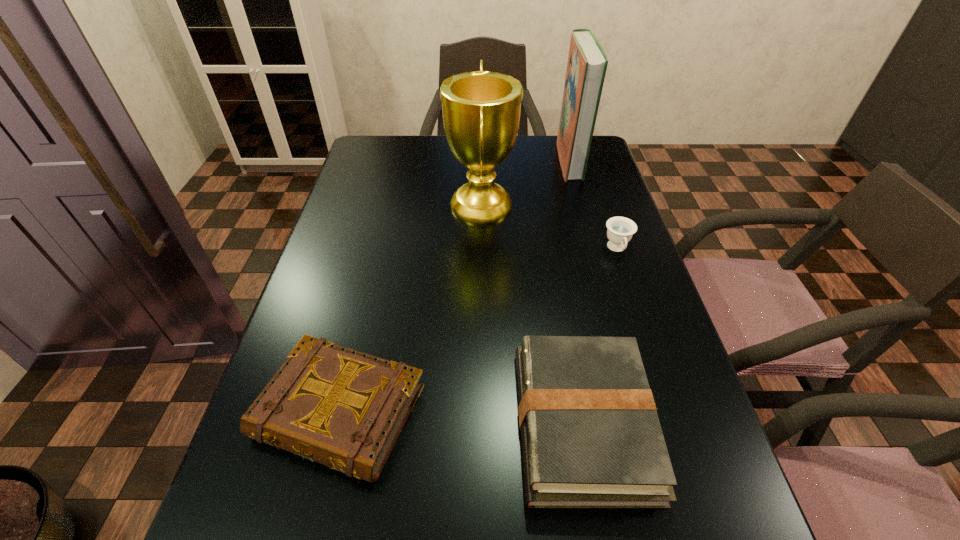
Where is `teacup located in the right edge section of the desktop`? Image resolution: width=960 pixels, height=540 pixels. teacup located in the right edge section of the desktop is located at coordinates (620, 230).

At what (x,y) coordinates should I click in order to perform the action: click on object at the far right corner. Please return your answer as a coordinate pair (x, y). This screenshot has width=960, height=540. Looking at the image, I should click on pyautogui.click(x=587, y=63).

In the image, there is a desktop. At what (x,y) coordinates should I click in order to perform the action: click on blank space at the far edge. Please return your answer as a coordinate pair (x, y). This screenshot has height=540, width=960. Looking at the image, I should click on (441, 146).

Where is `free space at the left edge of the desktop`? This screenshot has height=540, width=960. free space at the left edge of the desktop is located at coordinates (318, 280).

I want to click on free space at the right edge of the desktop, so [657, 300].

Find the location of a particular element. This screenshot has height=540, width=960. empty space between the teacup and the second tallest hardback book is located at coordinates (600, 336).

I want to click on free space between the farthest hardback book and the award, so click(525, 183).

The height and width of the screenshot is (540, 960). Find the location of `unoccupied area between the second shortest hardback book and the leftmost object`. unoccupied area between the second shortest hardback book and the leftmost object is located at coordinates (462, 417).

Identify the location of free spot between the teacup and the second tallest hardback book. This screenshot has width=960, height=540. (600, 336).

You are a GUI agent. You are given a task and a screenshot of the screen. Output one action in this format:
    pyautogui.click(x=<x>, y=<y>)
    Task: Click on the vacant space that is in between the award and the shortest hardback book
    This screenshot has width=960, height=540.
    Given the screenshot: What is the action you would take?
    pyautogui.click(x=411, y=309)